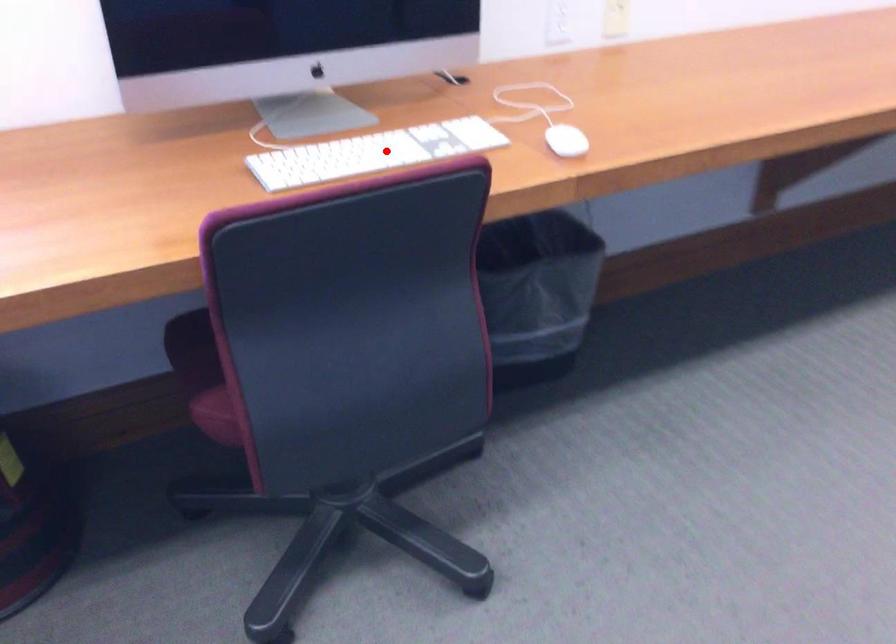
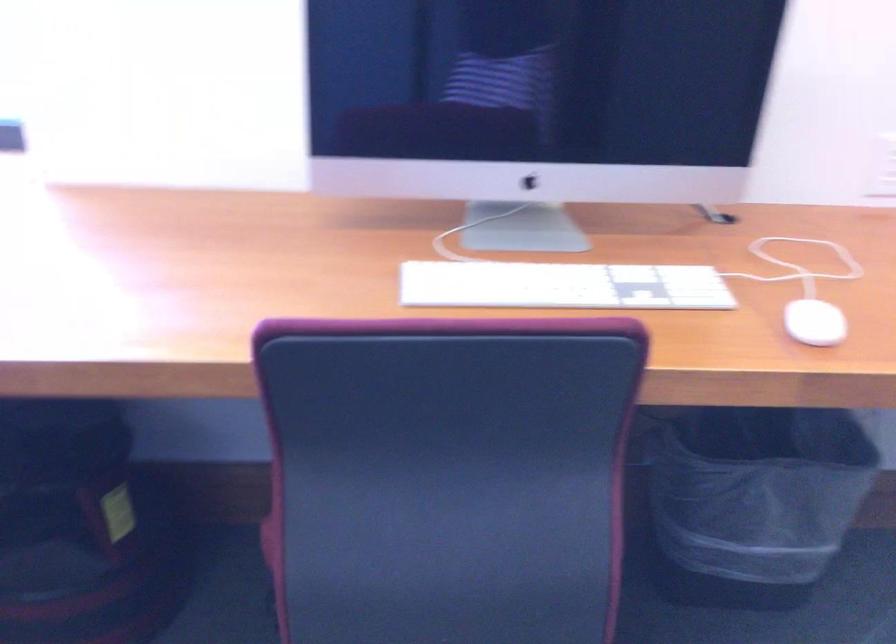
Find the pixel in the second image that matches the highlighted location in the first image.

(562, 285)